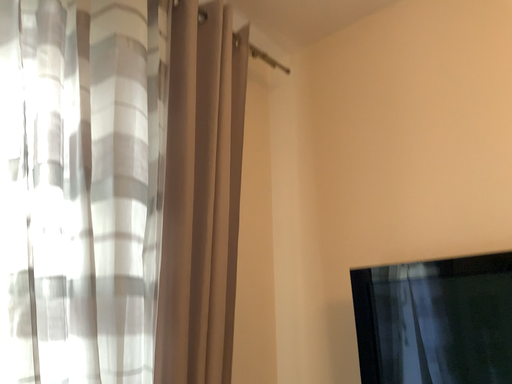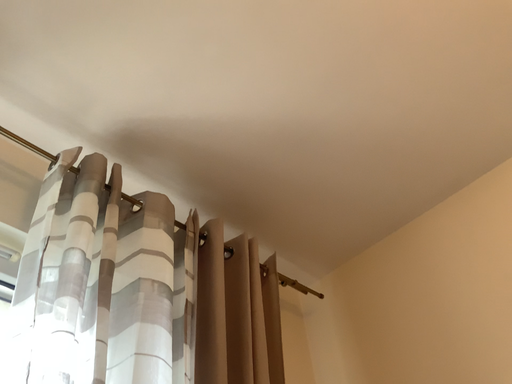
Question: How did the camera likely rotate when shooting the video?

Choices:
 (A) rotated downward
 (B) rotated upward

Answer: (B)